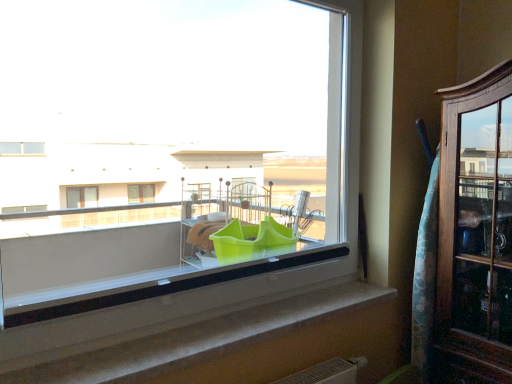
Question: Does green plastic container at center come in front of wooden cabinet at right?

Choices:
 (A) yes
 (B) no

Answer: (A)

Question: Considering the relative positions of green plastic container at center and wooden cabinet at right in the image provided, is green plastic container at center to the left of wooden cabinet at right from the viewer's perspective?

Choices:
 (A) no
 (B) yes

Answer: (B)

Question: Is green plastic container at center oriented away from wooden cabinet at right?

Choices:
 (A) yes
 (B) no

Answer: (B)

Question: Considering the relative sizes of green plastic container at center and wooden cabinet at right in the image provided, is green plastic container at center smaller than wooden cabinet at right?

Choices:
 (A) yes
 (B) no

Answer: (A)

Question: Can you confirm if green plastic container at center is taller than wooden cabinet at right?

Choices:
 (A) no
 (B) yes

Answer: (A)

Question: From the image's perspective, is green plastic container at center on top of wooden cabinet at right?

Choices:
 (A) no
 (B) yes

Answer: (B)

Question: Can you confirm if wooden cabinet at right is positioned to the right of smooth concrete window sill at center?

Choices:
 (A) yes
 (B) no

Answer: (A)

Question: From the image's perspective, does wooden cabinet at right appear higher than smooth concrete window sill at center?

Choices:
 (A) no
 (B) yes

Answer: (B)

Question: From a real-world perspective, is wooden cabinet at right physically below smooth concrete window sill at center?

Choices:
 (A) no
 (B) yes

Answer: (A)

Question: Can you confirm if wooden cabinet at right is positioned to the left of smooth concrete window sill at center?

Choices:
 (A) yes
 (B) no

Answer: (B)

Question: Would you say wooden cabinet at right is a long distance from smooth concrete window sill at center?

Choices:
 (A) yes
 (B) no

Answer: (B)

Question: Considering the relative sizes of wooden cabinet at right and smooth concrete window sill at center in the image provided, is wooden cabinet at right shorter than smooth concrete window sill at center?

Choices:
 (A) yes
 (B) no

Answer: (B)

Question: Does wooden cabinet at right have a greater height compared to green plastic container at center?

Choices:
 (A) yes
 (B) no

Answer: (A)